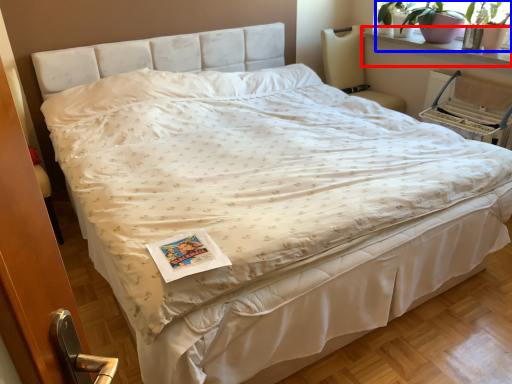
Question: Which point is closer to the camera, window sill (highlighted by a red box) or plant (highlighted by a blue box)?

Choices:
 (A) window sill
 (B) plant

Answer: (A)